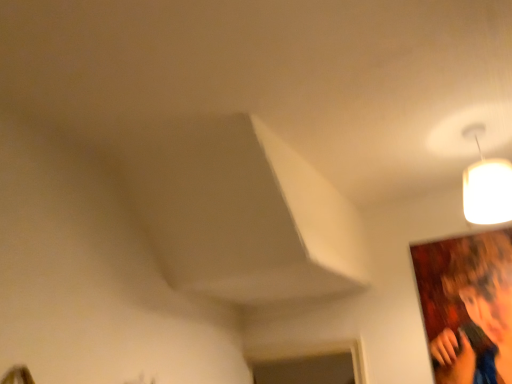
Question: Looking at the image, does white matte lampshade at upper right seem bigger or smaller compared to smooth brown hair at upper right?

Choices:
 (A) small
 (B) big

Answer: (B)

Question: In the image, is white matte lampshade at upper right positioned in front of or behind smooth brown hair at upper right?

Choices:
 (A) behind
 (B) front

Answer: (B)

Question: Is white matte lampshade at upper right inside or outside of smooth brown hair at upper right?

Choices:
 (A) outside
 (B) inside

Answer: (A)

Question: Is smooth brown hair at upper right bigger or smaller than white matte lampshade at upper right?

Choices:
 (A) small
 (B) big

Answer: (A)

Question: From a real-world perspective, relative to white matte lampshade at upper right, is smooth brown hair at upper right vertically above or below?

Choices:
 (A) below
 (B) above

Answer: (A)

Question: Is smooth brown hair at upper right taller or shorter than white matte lampshade at upper right?

Choices:
 (A) tall
 (B) short

Answer: (A)

Question: In the image, is smooth brown hair at upper right on the left side or the right side of white matte lampshade at upper right?

Choices:
 (A) left
 (B) right

Answer: (B)